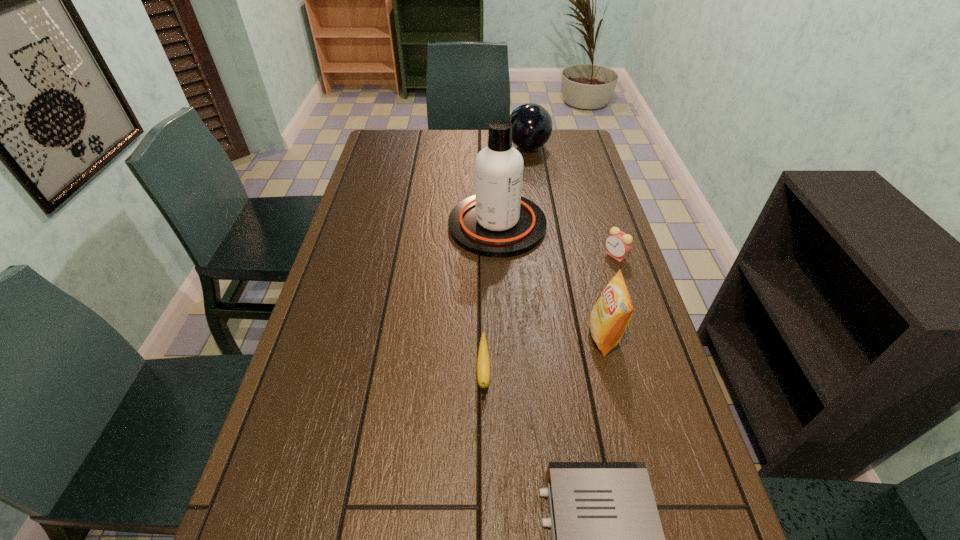
Where is `free space located on the front-facing side of the crisp (potato chip)`? free space located on the front-facing side of the crisp (potato chip) is located at coordinates (552, 336).

Image resolution: width=960 pixels, height=540 pixels. I want to click on vacant position located on the front-facing side of the crisp (potato chip), so click(435, 336).

This screenshot has width=960, height=540. Find the location of `free spot located on the face of the rightmost object`. free spot located on the face of the rightmost object is located at coordinates pyautogui.click(x=489, y=255).

Find the location of a particular element. vacant space located on the face of the rightmost object is located at coordinates (543, 255).

Find the location of a particular element. vacant area situated on the face of the rightmost object is located at coordinates (509, 255).

Identify the location of free location located 0.260m at the stem of the banana. This screenshot has height=540, width=960. (485, 539).

Find the location of a particular element. The height and width of the screenshot is (540, 960). object present at the far edge is located at coordinates (532, 125).

Identify the location of bowling ball that is at the right edge. This screenshot has height=540, width=960. (532, 125).

Where is `crisp (potato chip) that is at the right edge`? The height and width of the screenshot is (540, 960). crisp (potato chip) that is at the right edge is located at coordinates (608, 319).

Identify the location of alarm clock that is at the right edge. pos(618,244).